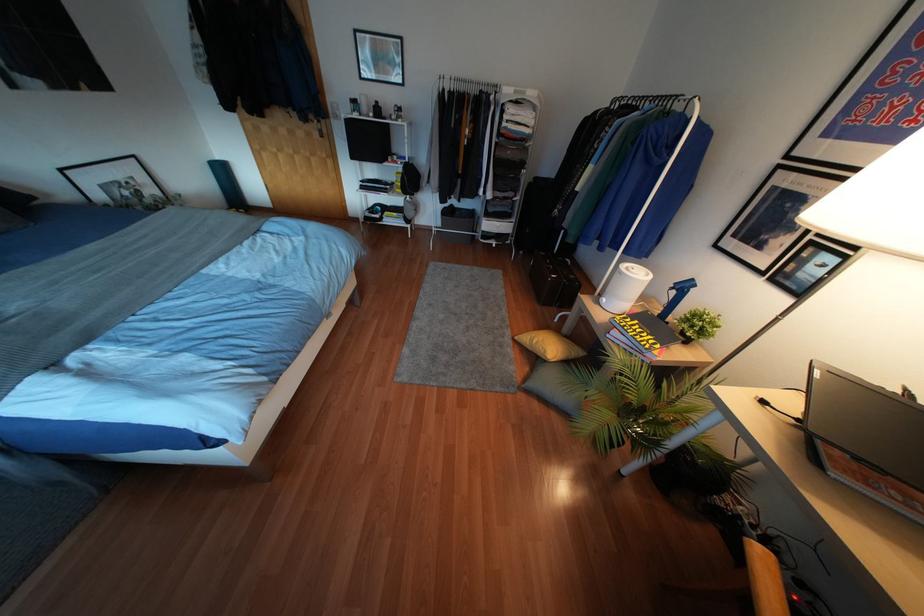
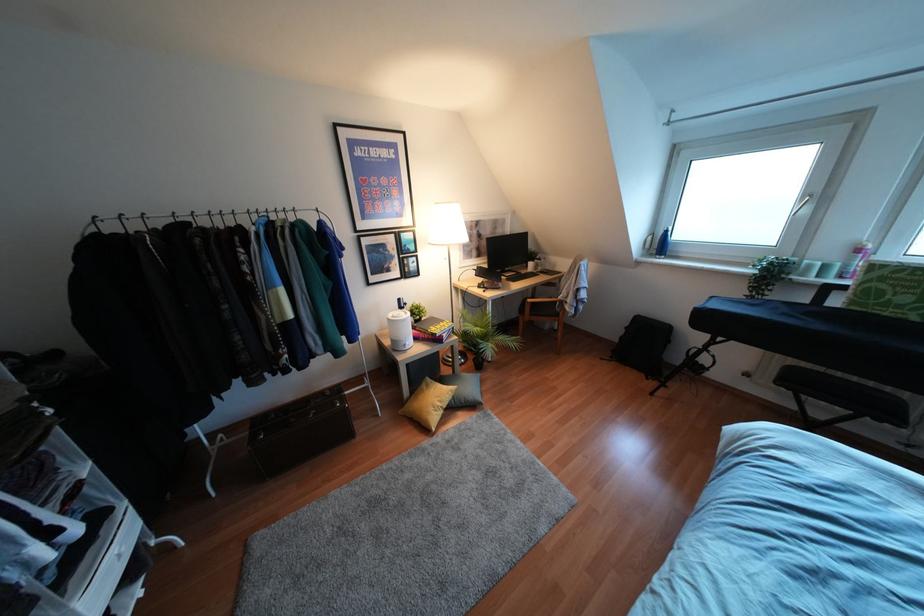
Where in the second image is the point corresponding to the point at 533,341 from the first image?

(439, 403)